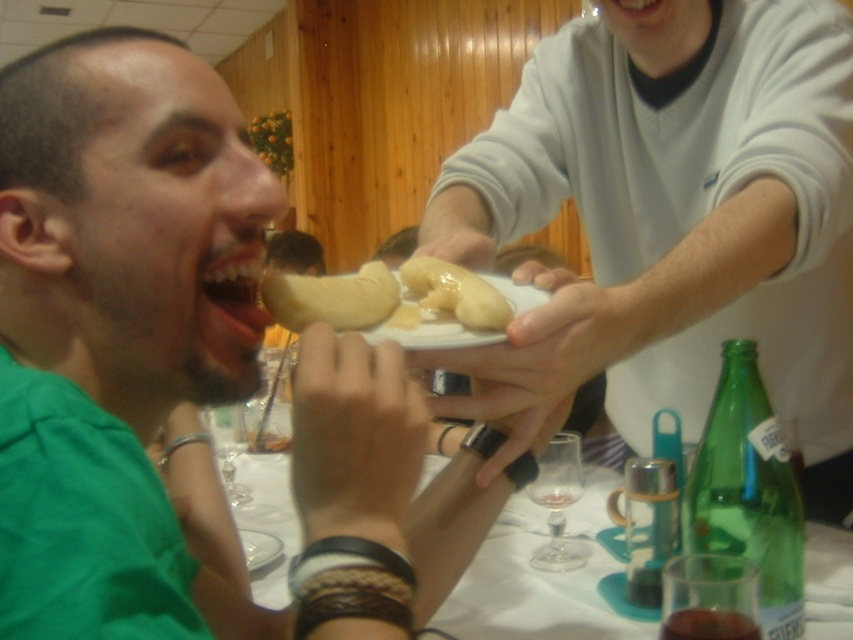
Question: Is yellowish matte banana at center positioned in front of white matte plate at center?

Choices:
 (A) yes
 (B) no

Answer: (B)

Question: Which of these objects is positioned closest to the white matte plate at center?

Choices:
 (A) yellowish matte banana at mouth
 (B) smooth white plate at center

Answer: (A)

Question: Does yellowish matte banana at mouth appear over white matte plate at center?

Choices:
 (A) no
 (B) yes

Answer: (B)

Question: Estimate the real-world distances between objects in this image. Which object is farther from the white matte plate at center?

Choices:
 (A) smooth white plate at center
 (B) yellowish matte banana at center

Answer: (A)

Question: Estimate the real-world distances between objects in this image. Which object is closer to the white matte plate at center?

Choices:
 (A) yellowish matte banana at center
 (B) smooth white plate at center

Answer: (A)

Question: Does yellowish matte banana at center appear on the left side of white matte plate at center?

Choices:
 (A) no
 (B) yes

Answer: (A)